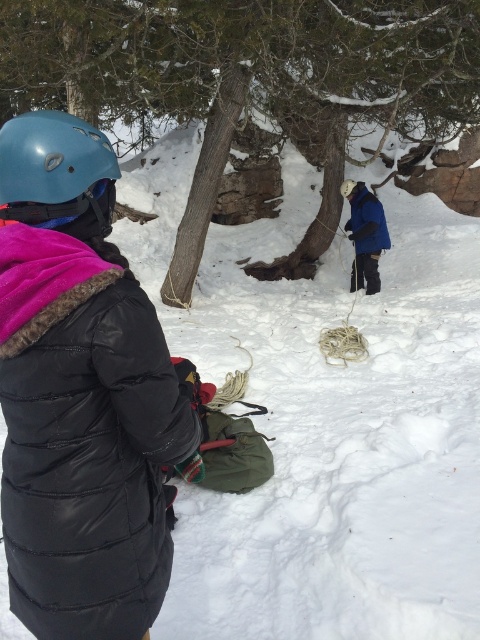
You are a photographer trying to capture the climber in the black puffy jacket at left. Based on the coordinates provided, where should you position your camera to ensure the climber is centered in your shot?

The black puffy jacket at left is located at coordinates point [80,394]. To center the climber in your shot, position your camera so that the center of your frame aligns with these coordinates.

You are a hiker who wants to check the visibility of the matte blue helmet at upper left and the blue fleece jacket at center. Based on the scene, which object is closer to you?

The matte blue helmet at upper left is closer to you because it is in front of the blue fleece jacket at center.

You are a photographer trying to capture a clear shot of both the black puffy jacket at left and the matte blue helmet at upper left. Which object should you focus on first to ensure it appears sharp in your photo?

You should focus on the black puffy jacket at left first because it is closer to the viewer than the matte blue helmet at upper left, so focusing on the closer object ensures both will be in focus if using proper depth of field.